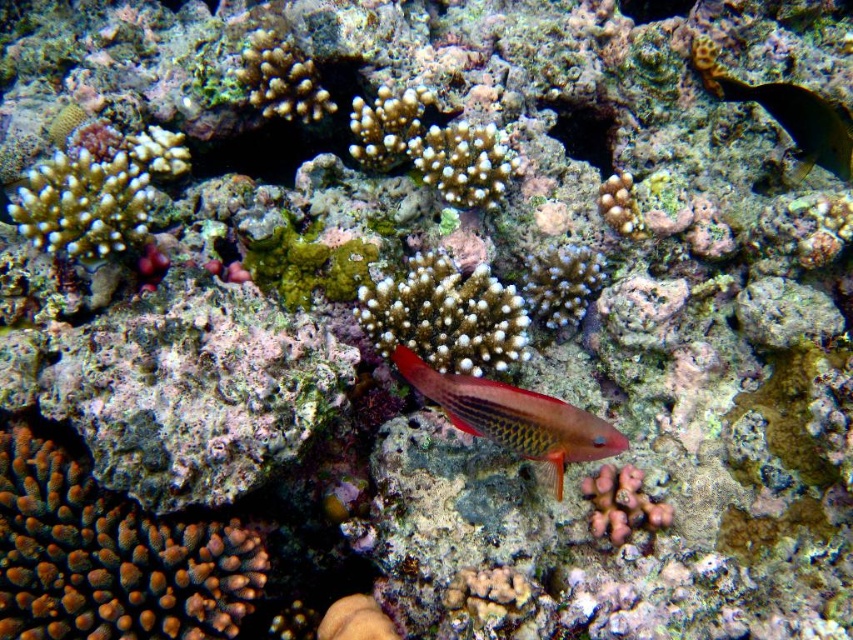
Question: Which object appears farthest from the camera in this image?

Choices:
 (A) white coral at center
 (B) shiny yellow fish at upper right

Answer: (B)

Question: Can you confirm if white coral at center is bigger than shiny yellow fish at upper right?

Choices:
 (A) no
 (B) yes

Answer: (A)

Question: Is white coral at center bigger than shiny red fish at center?

Choices:
 (A) yes
 (B) no

Answer: (A)

Question: Estimate the real-world distances between objects in this image. Which object is farther from the white coral at center?

Choices:
 (A) shiny yellow fish at upper right
 (B) shiny red fish at center

Answer: (A)

Question: Which of the following is the farthest from the observer?

Choices:
 (A) shiny red fish at center
 (B) white coral at center
 (C) shiny yellow fish at upper right

Answer: (C)

Question: Is white coral at center to the right of shiny yellow fish at upper right from the viewer's perspective?

Choices:
 (A) yes
 (B) no

Answer: (B)